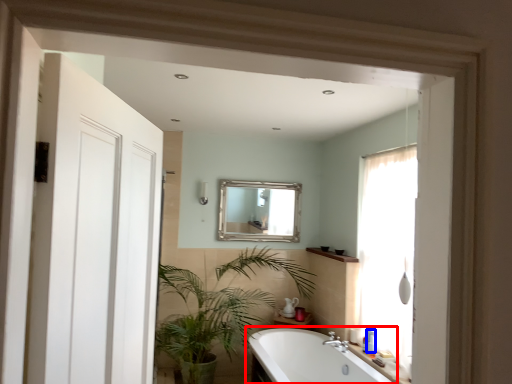
Question: Which of the following is the farthest to the observer, bathtub (highlighted by a red box) or toiletry (highlighted by a blue box)?

Choices:
 (A) bathtub
 (B) toiletry

Answer: (B)